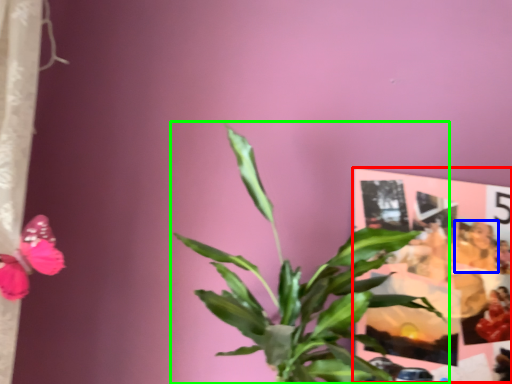
Question: Based on their relative distances, which object is nearer to postcard (highlighted by a red box)? Choose from person (highlighted by a blue box) and houseplant (highlighted by a green box).

Choices:
 (A) person
 (B) houseplant

Answer: (A)